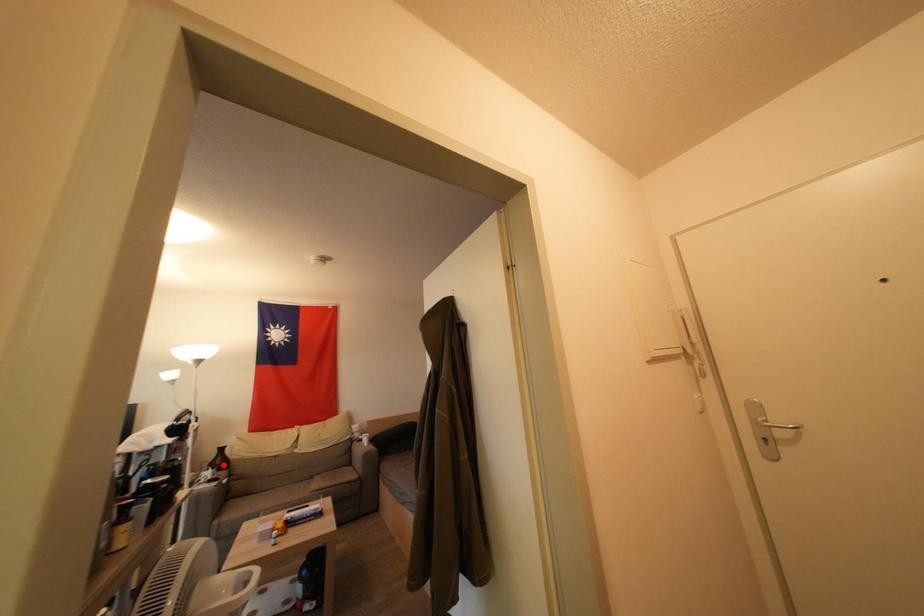
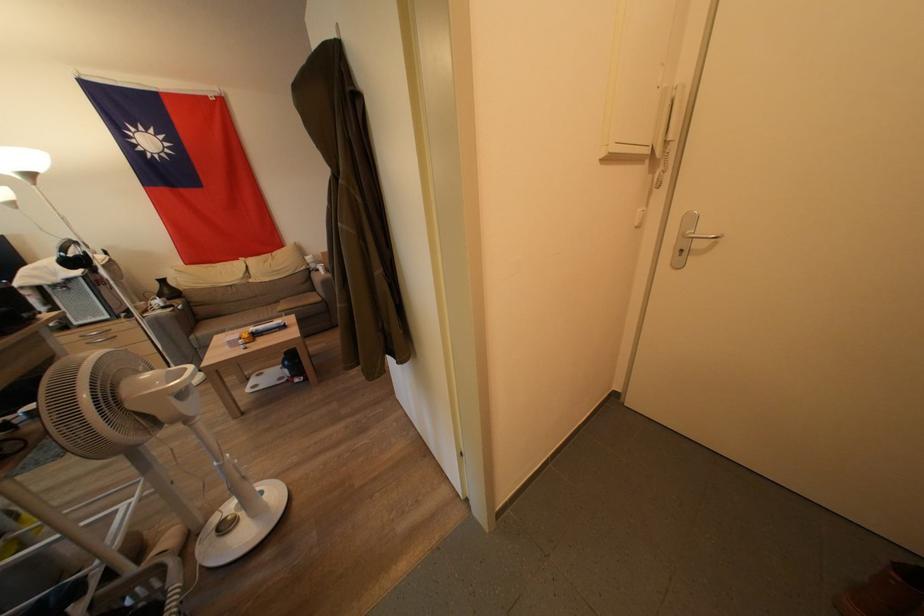
Where in the second image is the point corresponding to the highlighted location from the first image?

(172, 296)